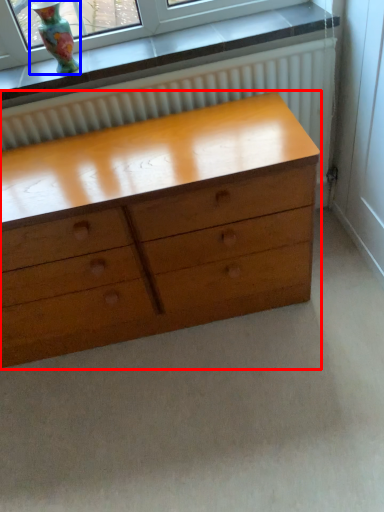
Question: Which object appears closest to the camera in this image, chest of drawers (highlighted by a red box) or vase (highlighted by a blue box)?

Choices:
 (A) chest of drawers
 (B) vase

Answer: (A)